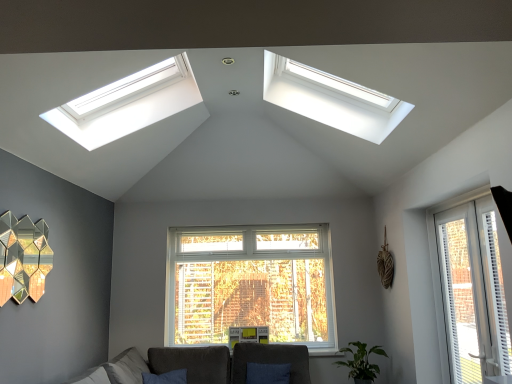
Question: Considering the positions of white plastic window at right, arranged as the second window when viewed from the top, and dark gray fabric couch at lower center in the image, is white plastic window at right, arranged as the second window when viewed from the top, bigger or smaller than dark gray fabric couch at lower center?

Choices:
 (A) big
 (B) small

Answer: (B)

Question: Is white plastic window at right, which is the 1th window from right to left, in front of or behind dark gray fabric couch at lower center in the image?

Choices:
 (A) front
 (B) behind

Answer: (A)

Question: Based on their relative distances, which object is farther from the velvet dark gray armchair at center?

Choices:
 (A) dark gray fabric couch at lower center
 (B) gold hexagonal mirror at left
 (C) green matte plant at lower right
 (D) white plastic skylight at upper center, the 1th window in the top-to-bottom sequence
 (E) white plastic window at right, marked as the 2th window in a left-to-right arrangement

Answer: (D)

Question: Which object is the closest to the gold hexagonal mirror at left?

Choices:
 (A) white plastic blinds at right
 (B) white plastic skylight at upper center, which is the second window in bottom-to-top order
 (C) green matte plant at lower right
 (D) velvet dark gray armchair at center
 (E) white plastic window at right, arranged as the second window when viewed from the top

Answer: (B)